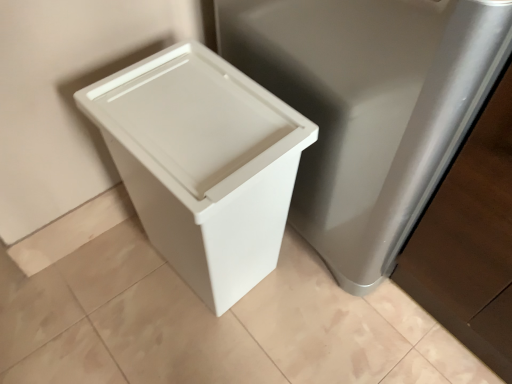
You are a GUI agent. You are given a task and a screenshot of the screen. Output one action in this format:
    pyautogui.click(x=<x>, y=<y>)
    Task: Click on the vacant area that is situated to the right of white plastic waste container at left
    This screenshot has height=384, width=512.
    Given the screenshot: What is the action you would take?
    pyautogui.click(x=317, y=301)